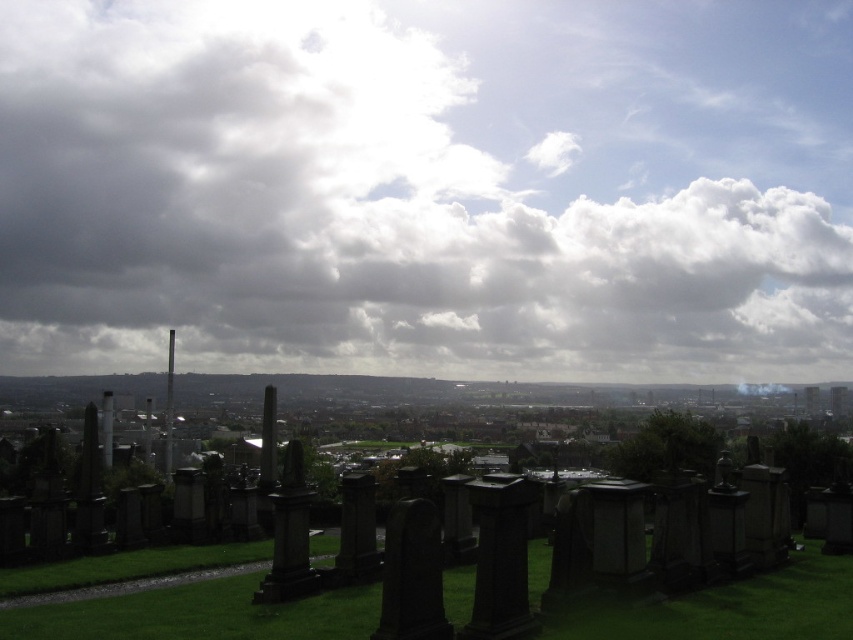
Does cloudy sky at upper center appear under black stone gravestones at lower center?

No, cloudy sky at upper center is not below black stone gravestones at lower center.

Measure the distance between cloudy sky at upper center and black stone gravestones at lower center.

The distance of cloudy sky at upper center from black stone gravestones at lower center is 1404.62 feet.

Measure the distance between point (225, 195) and camera.

Point (225, 195) is 495.15 meters away from camera.

The width and height of the screenshot is (853, 640). I want to click on cloudy sky at upper center, so point(428,188).

Who is shorter, cloudy sky at upper center or green grassy at lower center?

green grassy at lower center is shorter.

You are a GUI agent. You are given a task and a screenshot of the screen. Output one action in this format:
    pyautogui.click(x=<x>, y=<y>)
    Task: Click on the cloudy sky at upper center
    The height and width of the screenshot is (640, 853).
    Given the screenshot: What is the action you would take?
    pyautogui.click(x=428, y=188)

Does point (486, 324) lie in front of point (799, 634)?

No, (486, 324) is behind (799, 634).

Find the location of a particular element. This screenshot has height=640, width=853. cloudy sky at upper center is located at coordinates click(x=428, y=188).

Is black stone gravestones at lower center to the right of green grassy at lower center from the viewer's perspective?

Incorrect, black stone gravestones at lower center is not on the right side of green grassy at lower center.

Which is above, black stone gravestones at lower center or green grassy at lower center?

Positioned higher is black stone gravestones at lower center.

Describe the element at coordinates (512, 570) in the screenshot. The width and height of the screenshot is (853, 640). I see `black stone gravestones at lower center` at that location.

I want to click on black stone gravestones at lower center, so [512, 570].